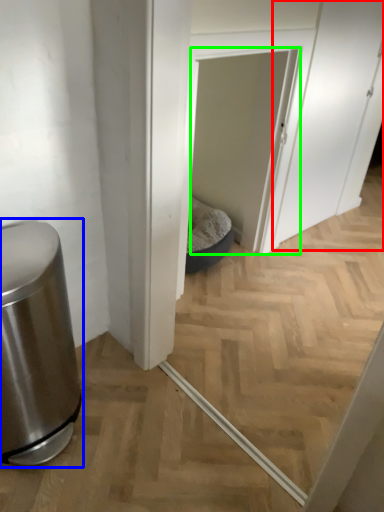
Question: Which is farther away from screen door (highlighted by a red box)? waste container (highlighted by a blue box) or screen door (highlighted by a green box)?

Choices:
 (A) waste container
 (B) screen door

Answer: (A)